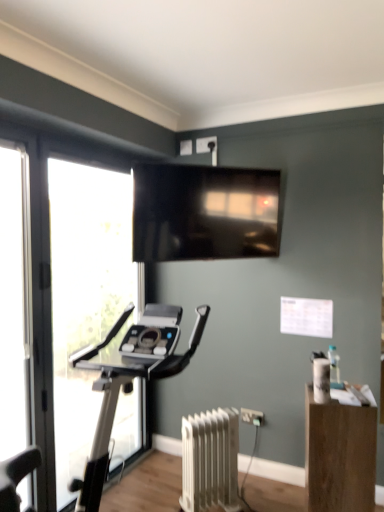
The image size is (384, 512). What do you see at coordinates (204, 212) in the screenshot? I see `matte black tv at upper center` at bounding box center [204, 212].

Identify the location of transparent glass window at left. (85, 295).

Locate an element on the screen. wooden box at lower right is located at coordinates (339, 455).

Describe the element at coordinates (339, 455) in the screenshot. I see `wooden box at lower right` at that location.

Identify the location of white matte radiator at lower center. This screenshot has height=512, width=384. (210, 460).

Locate an element on the screen. This screenshot has height=512, width=384. matte black tv at upper center is located at coordinates (204, 212).

Considering the relative positions of wooden box at lower right and transparent glass window at left in the image provided, is wooden box at lower right to the left of transparent glass window at left from the viewer's perspective?

No.

From a real-world perspective, is wooden box at lower right positioned above or below transparent glass window at left?

wooden box at lower right is situated lower than transparent glass window at left in the real world.

Considering the sizes of objects wooden box at lower right and transparent glass window at left in the image provided, who is wider, wooden box at lower right or transparent glass window at left?

Wider between the two is wooden box at lower right.

Is there a large distance between wooden box at lower right and transparent glass window at left?

Absolutely, wooden box at lower right is distant from transparent glass window at left.

Between white matte radiator at lower center and clear glass screen door at left, which one has more height?

Standing taller between the two is clear glass screen door at left.

From the image's perspective, which one is positioned higher, white matte radiator at lower center or clear glass screen door at left?

clear glass screen door at left appears higher in the image.

Is white matte radiator at lower center positioned before clear glass screen door at left?

No, white matte radiator at lower center is further to the viewer.

Is there a large distance between clear glass screen door at left and wooden box at lower right?

Absolutely, clear glass screen door at left is distant from wooden box at lower right.

From a real-world perspective, is clear glass screen door at left physically located above or below wooden box at lower right?

clear glass screen door at left is above wooden box at lower right.

Considering the positions of objects clear glass screen door at left and wooden box at lower right in the image provided, who is in front, clear glass screen door at left or wooden box at lower right?

clear glass screen door at left is more forward.

Is clear glass screen door at left at the right side of wooden box at lower right?

No.

Is transparent glass window at left taller than clear glass screen door at left?

Correct, transparent glass window at left is much taller as clear glass screen door at left.

Which object is positioned more to the left, transparent glass window at left or clear glass screen door at left?

clear glass screen door at left.

At what (x,y) coordinates should I click in order to perform the action: click on window located behind the clear glass screen door at left. Please return your answer as a coordinate pair (x, y). The image size is (384, 512). Looking at the image, I should click on (85, 295).

Which is nearer, (312,456) or (236,410)?

Point (312,456) appears to be closer to the viewer than point (236,410).

Does wooden box at lower right have a greater width compared to white matte radiator at lower center?

Indeed, wooden box at lower right has a greater width compared to white matte radiator at lower center.

Does wooden box at lower right turn towards white matte radiator at lower center?

No.

From a real-world perspective, is wooden box at lower right above or below white matte radiator at lower center?

wooden box at lower right is above white matte radiator at lower center.

Between clear glass screen door at left and white matte radiator at lower center, which one has larger size?

With larger size is white matte radiator at lower center.

Would you say clear glass screen door at left is inside or outside white matte radiator at lower center?

clear glass screen door at left is not enclosed by white matte radiator at lower center.

Which is more to the right, clear glass screen door at left or white matte radiator at lower center?

white matte radiator at lower center.

Is point (211, 423) closer or farther from the camera than point (162, 179)?

Point (211, 423) appears to be farther away from the viewer than point (162, 179).

Can you confirm if white matte radiator at lower center is smaller than matte black tv at upper center?

Correct, white matte radiator at lower center occupies less space than matte black tv at upper center.

Between white matte radiator at lower center and matte black tv at upper center, which one has smaller width?

With smaller width is matte black tv at upper center.

From the image's perspective, is white matte radiator at lower center under matte black tv at upper center?

Yes.

Where is `furniture in front of the transparent glass window at left`? The image size is (384, 512). furniture in front of the transparent glass window at left is located at coordinates (339, 455).

Image resolution: width=384 pixels, height=512 pixels. I want to click on radiator below the clear glass screen door at left (from a real-world perspective), so click(210, 460).

Considering their positions, is wooden box at lower right positioned closer to white matte radiator at lower center than clear glass screen door at left?

The object closer to white matte radiator at lower center is wooden box at lower right.

When comparing their distances from white matte radiator at lower center, does wooden box at lower right or transparent glass window at left seem further?

transparent glass window at left is further to white matte radiator at lower center.

Considering their positions, is white matte radiator at lower center positioned further to wooden box at lower right than clear glass screen door at left?

The object further to wooden box at lower right is clear glass screen door at left.

Considering their positions, is wooden box at lower right positioned closer to matte black tv at upper center than clear glass screen door at left?

Among the two, clear glass screen door at left is located nearer to matte black tv at upper center.

Considering their positions, is clear glass screen door at left positioned closer to white matte radiator at lower center than transparent glass window at left?

transparent glass window at left is positioned closer to the anchor white matte radiator at lower center.

Estimate the real-world distances between objects in this image. Which object is closer to matte black tv at upper center, wooden box at lower right or white matte radiator at lower center?

Among the two, white matte radiator at lower center is located nearer to matte black tv at upper center.

When comparing their distances from white matte radiator at lower center, does transparent glass window at left or clear glass screen door at left seem closer?

transparent glass window at left is positioned closer to the anchor white matte radiator at lower center.

When comparing their distances from wooden box at lower right, does matte black tv at upper center or white matte radiator at lower center seem closer?

white matte radiator at lower center.

Where is `screen door between matte black tv at upper center and white matte radiator at lower center from top to bottom`? This screenshot has height=512, width=384. screen door between matte black tv at upper center and white matte radiator at lower center from top to bottom is located at coordinates (15, 303).

Identify the location of radiator located between transparent glass window at left and wooden box at lower right in the left-right direction. This screenshot has height=512, width=384. (210, 460).

What are the coordinates of `television located between clear glass screen door at left and wooden box at lower right in the left-right direction` in the screenshot? It's located at (204, 212).

The width and height of the screenshot is (384, 512). I want to click on radiator between clear glass screen door at left and wooden box at lower right in the horizontal direction, so click(x=210, y=460).